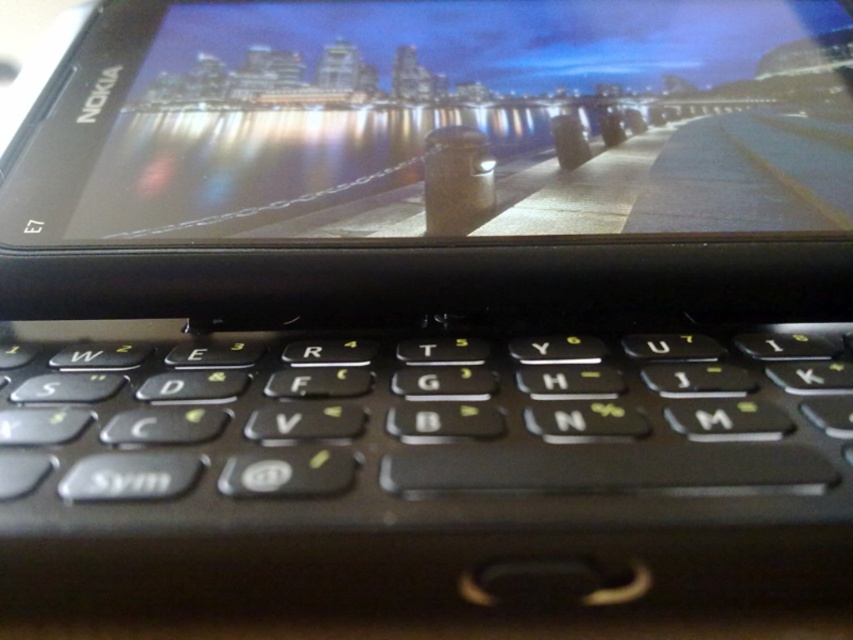
In the scene shown: You are holding the Nokia E7 smartphone and want to type a message. The screen shows a cityscape at night. Which object is taller between the black plastic keyboard at center and the matte black screen at upper center?

The matte black screen at upper center is taller than the black plastic keyboard at center.

You are holding a camera and want to take a photo of the black plastic keyboard at center. The camera requires the subject to be at least 9 inches away to focus properly. Can you take the photo without moving the keyboard?

The black plastic keyboard at center is 8.97 inches from camera, which is less than the required 9 inches. Therefore, you cannot take the photo without moving the keyboard closer to meet the minimum distance requirement.